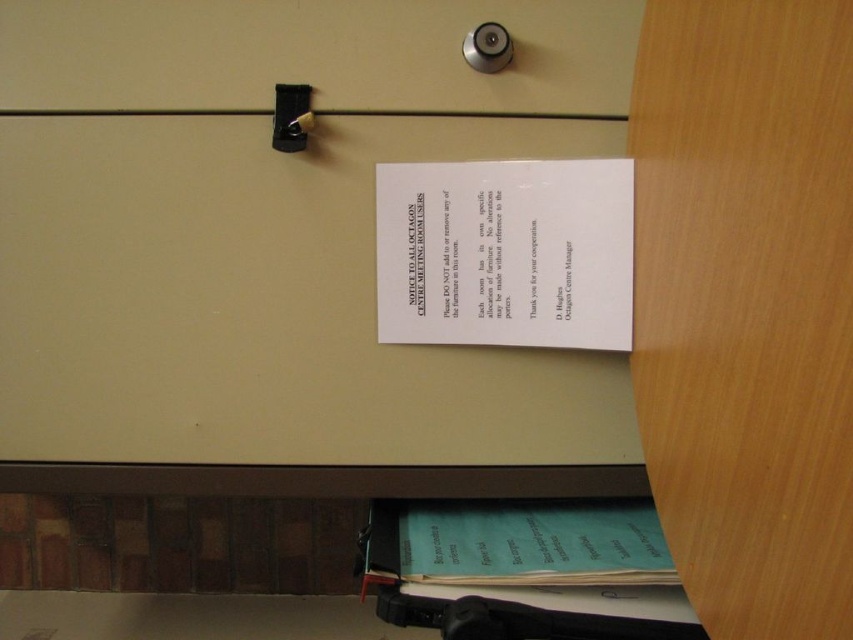
Question: Where is matte plastic drawer at upper center located in relation to white paper at center in the image?

Choices:
 (A) right
 (B) left

Answer: (B)

Question: Which object appears farthest from the camera in this image?

Choices:
 (A) matte plastic drawer at upper center
 (B) white paper at center

Answer: (A)

Question: Where is matte plastic drawer at upper center located in relation to white paper at center in the image?

Choices:
 (A) below
 (B) above

Answer: (B)

Question: Which point is closer to the camera?

Choices:
 (A) white paper at center
 (B) matte plastic drawer at upper center

Answer: (A)

Question: Does matte plastic drawer at upper center have a lesser width compared to white paper at center?

Choices:
 (A) yes
 (B) no

Answer: (B)